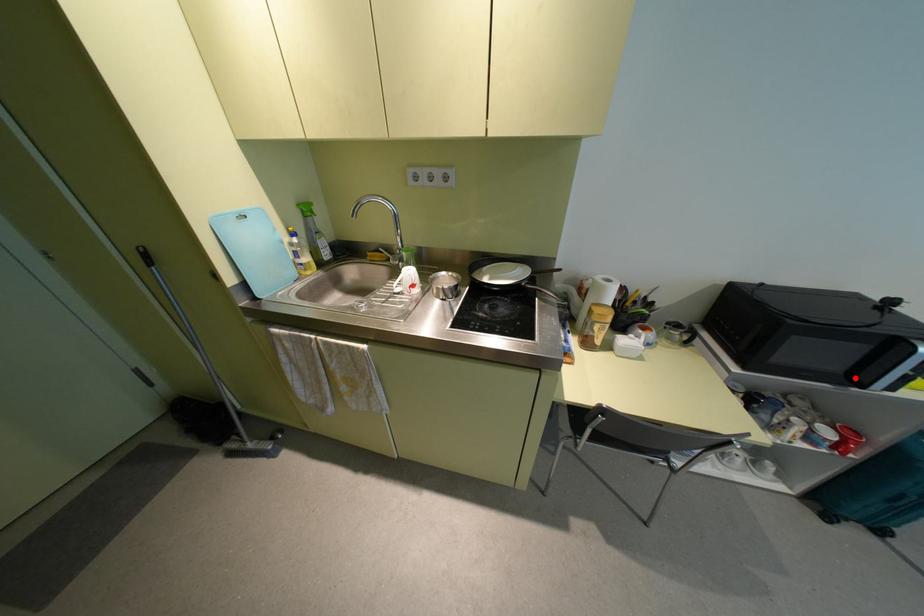
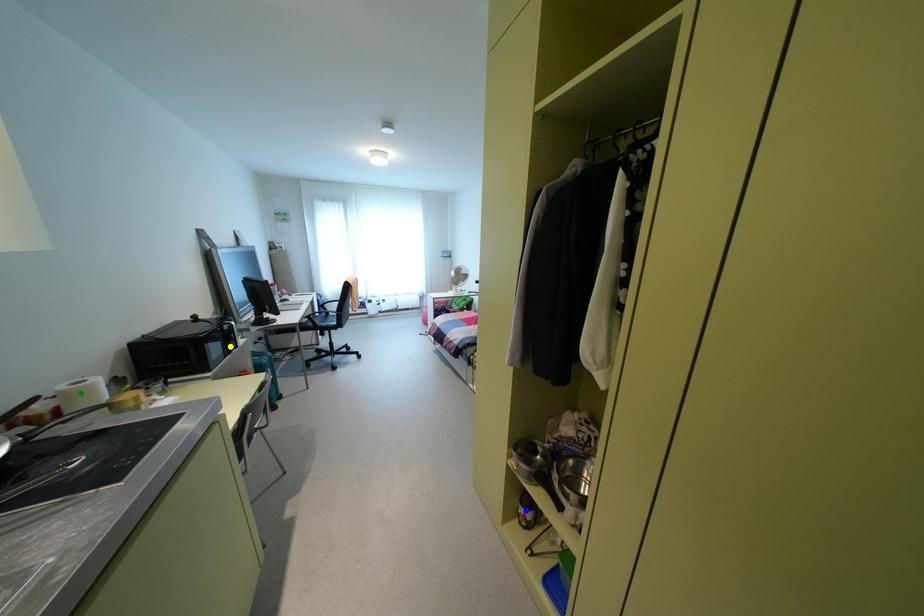
Question: I am providing you with two images of the same scene from different viewpoints. A red point is marked on the first image. You are given multiple points on the second image. Which point in image 2 represents the same 3d spot as the red point in image 1?

Choices:
 (A) yellow point
 (B) green point
 (C) blue point

Answer: (A)